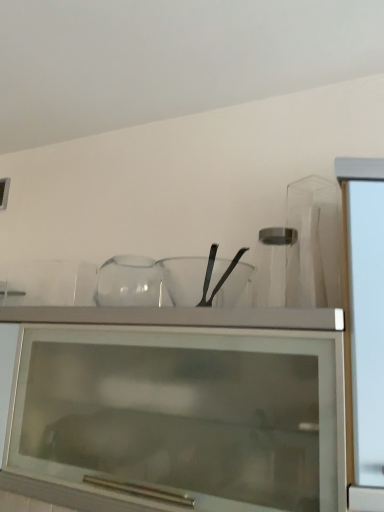
Question: Is transparent glass cabinet at upper center thinner than transparent glass mixing bowl at center?

Choices:
 (A) no
 (B) yes

Answer: (A)

Question: Is transparent glass cabinet at upper center bigger than transparent glass mixing bowl at center?

Choices:
 (A) no
 (B) yes

Answer: (B)

Question: Is transparent glass cabinet at upper center completely or partially outside of transparent glass mixing bowl at center?

Choices:
 (A) yes
 (B) no

Answer: (A)

Question: Does transparent glass cabinet at upper center have a greater width compared to transparent glass mixing bowl at center?

Choices:
 (A) yes
 (B) no

Answer: (A)

Question: From a real-world perspective, is transparent glass cabinet at upper center under transparent glass mixing bowl at center?

Choices:
 (A) yes
 (B) no

Answer: (A)

Question: Does point (57, 420) appear closer or farther from the camera than point (183, 268)?

Choices:
 (A) closer
 (B) farther

Answer: (A)

Question: Relative to transparent glass mixing bowl at center, is transparent glass cabinet at upper center in front or behind?

Choices:
 (A) behind
 (B) front

Answer: (B)

Question: Looking at the image, does transparent glass cabinet at upper center seem bigger or smaller compared to transparent glass mixing bowl at center?

Choices:
 (A) big
 (B) small

Answer: (A)

Question: From a real-world perspective, relative to transparent glass mixing bowl at center, is transparent glass cabinet at upper center vertically above or below?

Choices:
 (A) below
 (B) above

Answer: (A)

Question: In terms of height, does transparent glass mixing bowl at center look taller or shorter compared to transparent glass jar at center?

Choices:
 (A) short
 (B) tall

Answer: (A)

Question: Considering the positions of transparent glass mixing bowl at center and transparent glass jar at center in the image, is transparent glass mixing bowl at center bigger or smaller than transparent glass jar at center?

Choices:
 (A) small
 (B) big

Answer: (B)

Question: Is point (211, 284) closer or farther from the camera than point (271, 275)?

Choices:
 (A) farther
 (B) closer

Answer: (A)

Question: Would you say transparent glass mixing bowl at center is to the left or to the right of transparent glass jar at center in the picture?

Choices:
 (A) left
 (B) right

Answer: (A)

Question: Considering the relative positions of transparent glass jar at center and transparent glass cabinet at upper center in the image provided, is transparent glass jar at center to the left or to the right of transparent glass cabinet at upper center?

Choices:
 (A) left
 (B) right

Answer: (B)

Question: Does point (281, 301) appear closer or farther from the camera than point (221, 345)?

Choices:
 (A) closer
 (B) farther

Answer: (B)